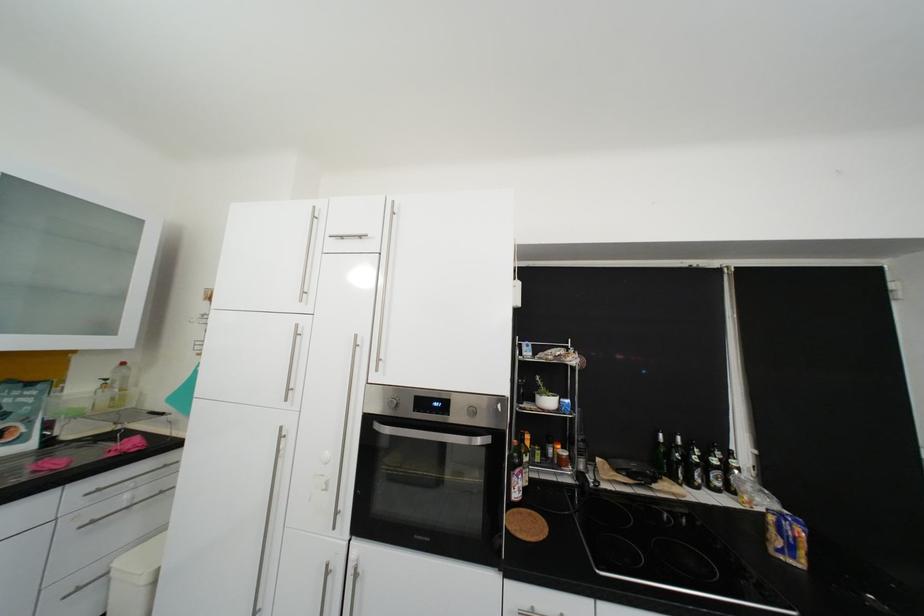
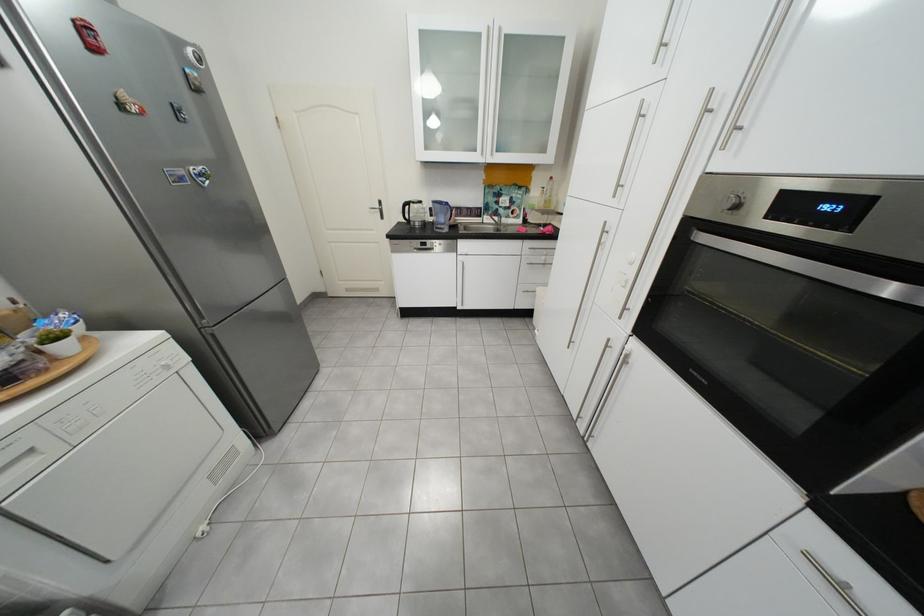
How did the camera likely rotate?

The rotation direction of the camera is left-down.